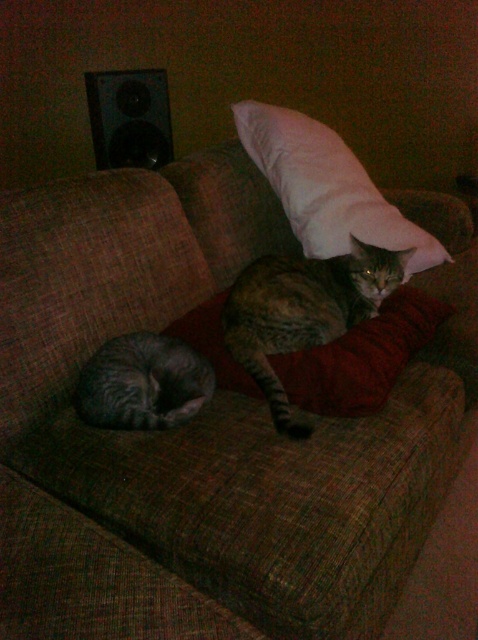
You are a cat owner who wants to place a toy between the tabby fur cat at center and the white soft pillow at upper center so both can reach it easily. Given that the toy requires a minimum space of 12 inches to be accessible to both, can the toy be placed between them?

The distance between the tabby fur cat at center and the white soft pillow at upper center is 15.76 inches, which is greater than the required 12 inches. Therefore, the toy can be placed between them so both can reach it easily.

You are a cat owner who wants to place a new toy between the white soft pillow at upper center and the black plastic speaker at upper left. Based on their positions, which object should the toy be closer to?

The white soft pillow at upper center is positioned on the right side of the black plastic speaker at upper left, so the toy should be placed closer to the black plastic speaker at upper left to be between them.

From the picture: You are a photographer trying to capture a closeup of the cats on the couch. You notice two specific points marked in the image. Which point, point (315, 202) or point (155, 70), is closer to the camera?

Point (315, 202) is in front of point (155, 70), so it is closer to the camera.